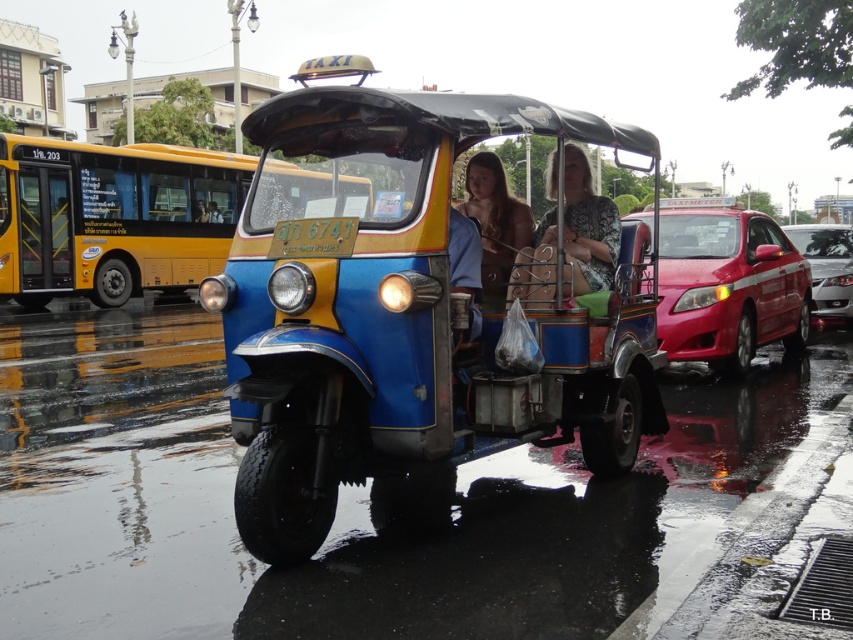
Between shiny blue tuk-tuk at center and shiny red car at right, which one has more height?

With more height is shiny blue tuk-tuk at center.

What do you see at coordinates (418, 304) in the screenshot? I see `shiny blue tuk-tuk at center` at bounding box center [418, 304].

Who is more distant from viewer, [428,246] or [751,216]?

Positioned behind is point [751,216].

Identify the location of shiny blue tuk-tuk at center. Image resolution: width=853 pixels, height=640 pixels. (418, 304).

From the picture: Which is below, patterned fabric bag at center or brown leather jacket at center?

brown leather jacket at center is below.

Is point (590, 230) more distant than point (495, 195)?

Yes, point (590, 230) is farther from viewer.

The height and width of the screenshot is (640, 853). Find the location of `patterned fabric bag at center`. patterned fabric bag at center is located at coordinates (569, 236).

Does shiny blue tuk-tuk at center have a smaller size compared to brown leather jacket at center?

No.

Does point (335, 381) come behind point (524, 232)?

That is False.

What are the coordinates of `shiny blue tuk-tuk at center` in the screenshot? It's located at (418, 304).